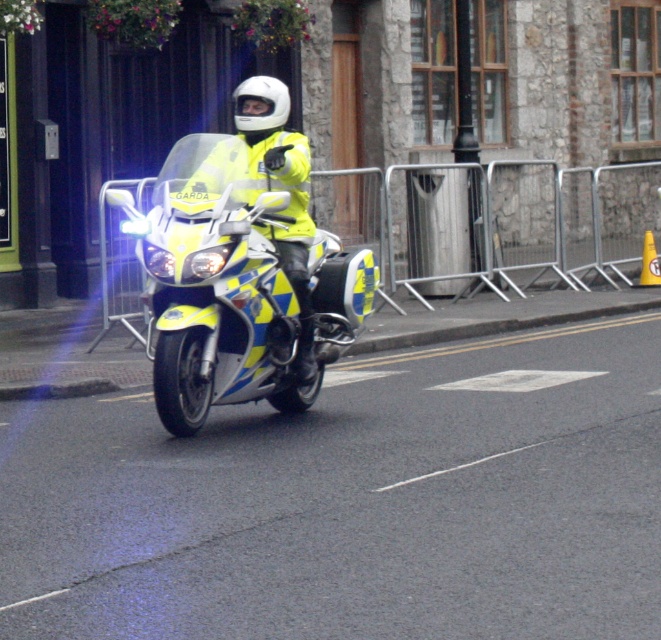
You are a pedestrian standing on the sidewalk and see the yellow reflective motorcycle at center and the yellow matte jacket at center. Which object is wider?

The yellow reflective motorcycle at center is wider than the yellow matte jacket at center.